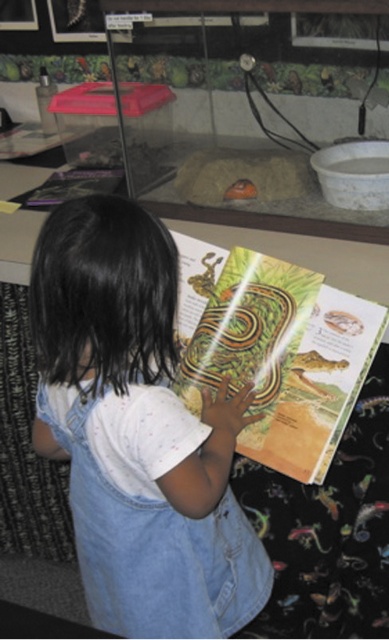
Question: Is denim overalls at center further to the viewer compared to matte yellow book at center?

Choices:
 (A) yes
 (B) no

Answer: (B)

Question: Where is denim overalls at center located in relation to matte yellow book at center in the image?

Choices:
 (A) left
 (B) right

Answer: (A)

Question: Which point is closer to the camera taking this photo?

Choices:
 (A) (82, 296)
 (B) (280, 260)

Answer: (A)

Question: Is denim overalls at center above matte yellow book at center?

Choices:
 (A) no
 (B) yes

Answer: (A)

Question: Which of the following is the closest to the observer?

Choices:
 (A) (175, 241)
 (B) (143, 625)

Answer: (B)